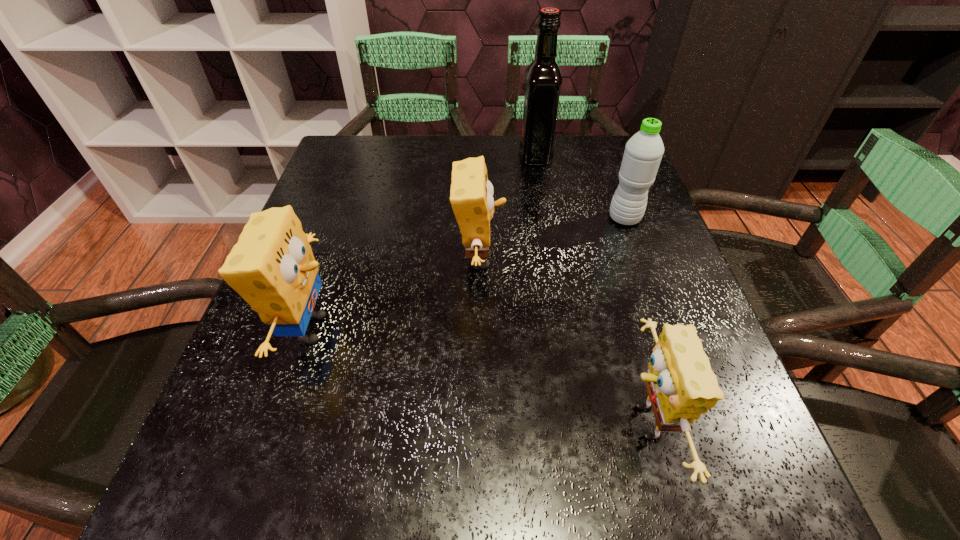
Identify the location of sponge that is at the right edge. (681, 386).

You are a GUI agent. You are given a task and a screenshot of the screen. Output one action in this format:
    pyautogui.click(x=<x>, y=<y>)
    Task: Click on the object that is at the near right corner
    This screenshot has width=960, height=540.
    Given the screenshot: What is the action you would take?
    pyautogui.click(x=681, y=386)

In the image, there is a desktop. Where is `vacant space at the far edge`? The width and height of the screenshot is (960, 540). vacant space at the far edge is located at coordinates (489, 156).

Identify the location of free region at the left edge. (366, 253).

Where is `vacant space at the right edge`? The width and height of the screenshot is (960, 540). vacant space at the right edge is located at coordinates (650, 214).

At what (x,y) coordinates should I click in order to perform the action: click on vacant space at the far left corner. Please return your answer as a coordinate pair (x, y). The width and height of the screenshot is (960, 540). Looking at the image, I should click on (360, 176).

I want to click on vacant area at the far right corner, so pyautogui.click(x=578, y=177).

At what (x,y) coordinates should I click in order to perform the action: click on free point between the water bottle and the fourth object from right to left. Please return your answer as a coordinate pair (x, y). The width and height of the screenshot is (960, 540). Looking at the image, I should click on (552, 239).

What are the coordinates of `free space between the second sponge from left to right and the rightmost sponge` in the screenshot? It's located at (562, 341).

Find the location of a particular element. This screenshot has height=540, width=960. vacant space that's between the water bottle and the second sponge from left to right is located at coordinates (552, 239).